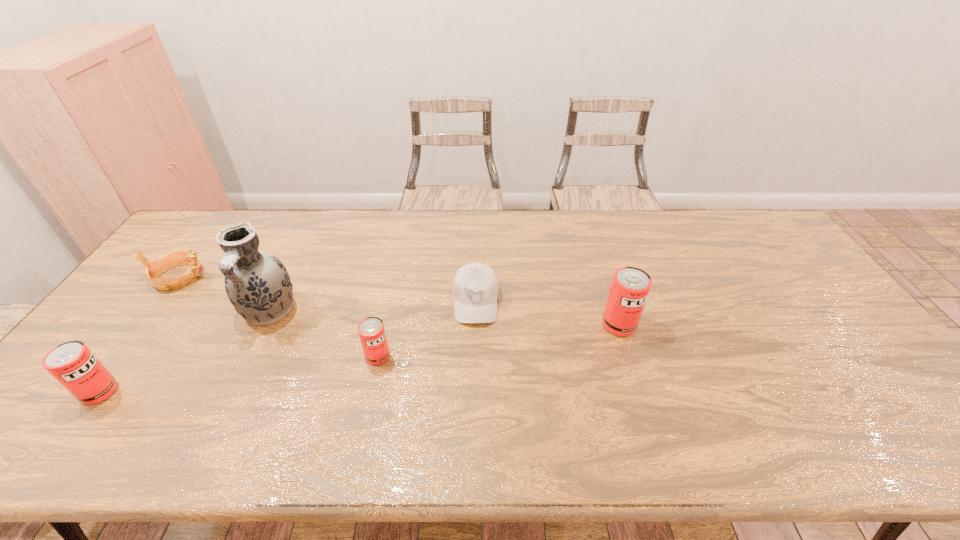
Image resolution: width=960 pixels, height=540 pixels. Identify the location of vacant region that satisfies the following two spatial constraints: 1. on the front-facing side of the rightmost object; 2. on the right side of the baseball cap. (475, 325).

Locate an element on the screen. free point that satisfies the following two spatial constraints: 1. with the handle on the side of the shortest can; 2. on the right side of the third object from left to right is located at coordinates (248, 356).

The height and width of the screenshot is (540, 960). In order to click on vacant space that satisfies the following two spatial constraints: 1. on the back side of the shortest can; 2. on the right side of the rightmost can in this screenshot , I will do `click(384, 325)`.

Find the location of `vacant space that satisfies the following two spatial constraints: 1. at the front emblem of the rightmost object; 2. on the left side of the tiara`. vacant space that satisfies the following two spatial constraints: 1. at the front emblem of the rightmost object; 2. on the left side of the tiara is located at coordinates (142, 325).

This screenshot has width=960, height=540. In order to click on vacant space that satisfies the following two spatial constraints: 1. on the back side of the rightmost object; 2. at the front emblem of the tiara in this screenshot , I will do `click(604, 276)`.